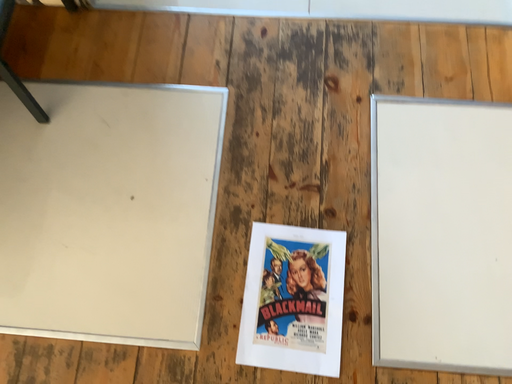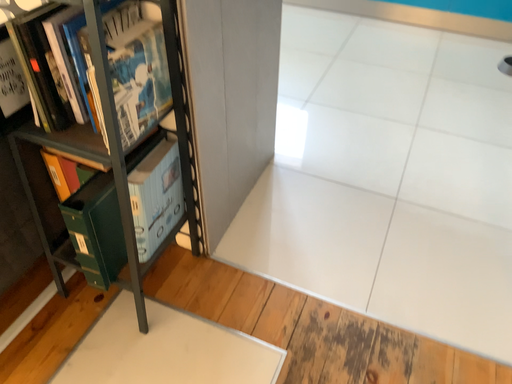
Question: Which way did the camera rotate in the video?

Choices:
 (A) rotated upward
 (B) rotated downward

Answer: (A)